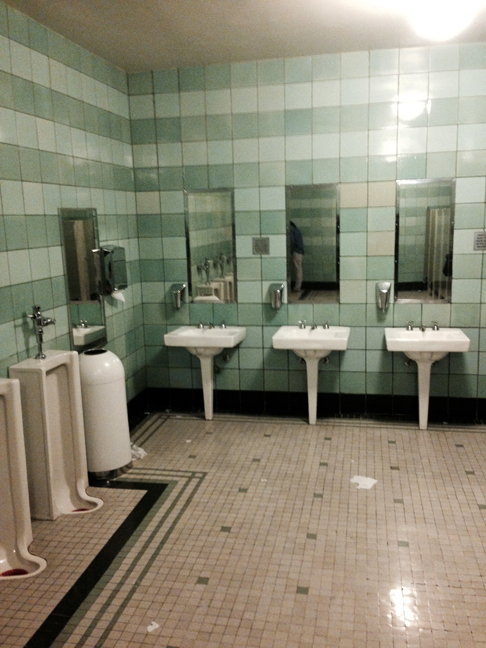
The width and height of the screenshot is (486, 648). Identify the location of ceiling light. (429, 17).